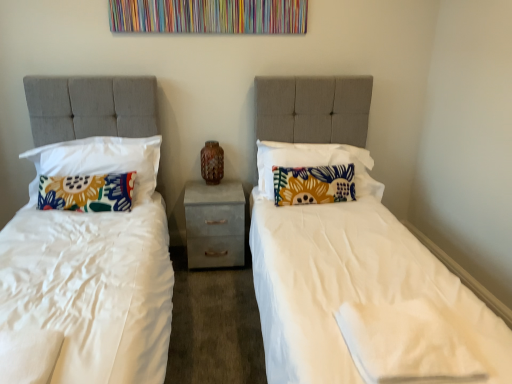
At what (x,y) coordinates should I click in order to perform the action: click on space that is in front of brown textured vase at center. Please return your answer as a coordinate pair (x, y). This screenshot has width=512, height=384. Looking at the image, I should click on (205, 189).